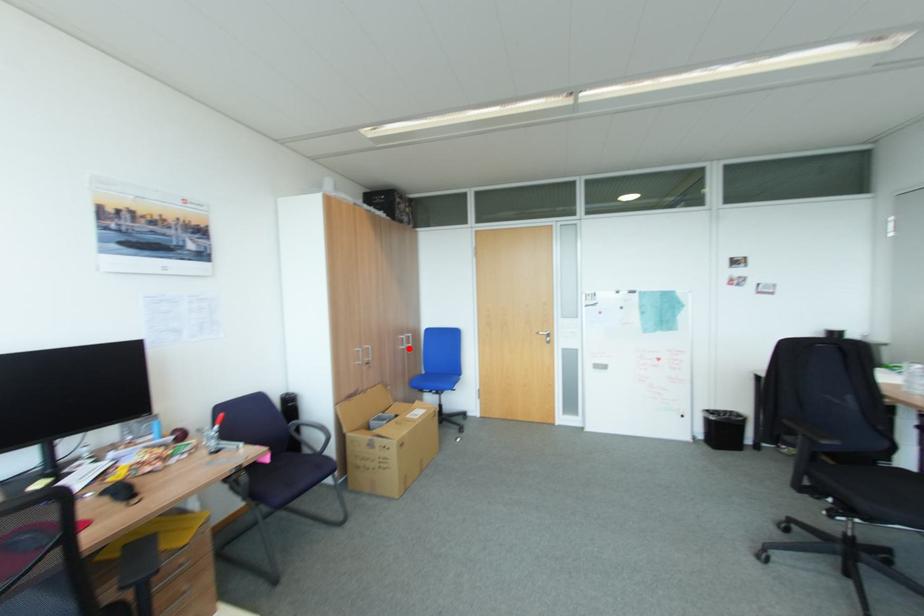
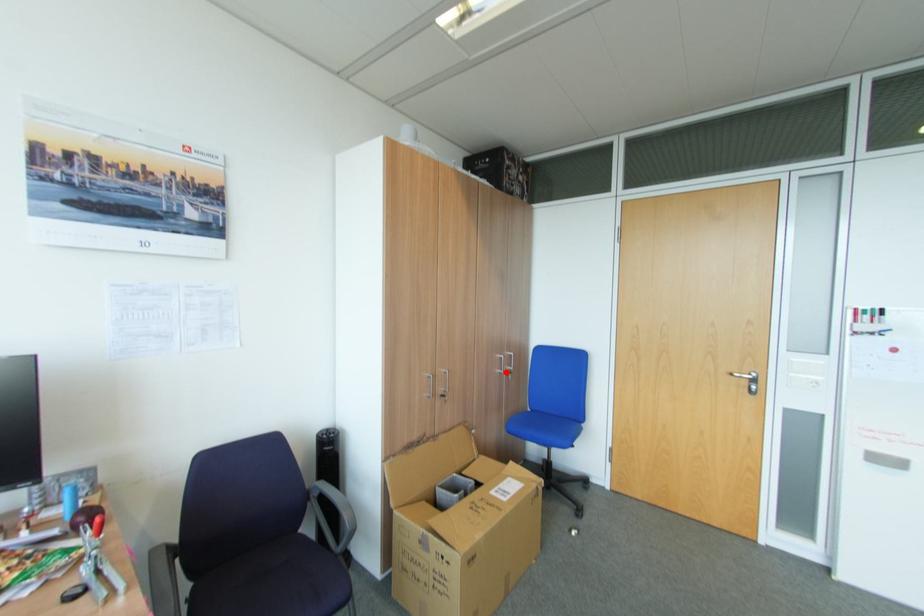
I am providing you with two images of the same scene from different viewpoints. A red point is marked on the first image and another point is marked on the second image. Are the points marked in image1 and image2 representing the same 3D position?

Yes